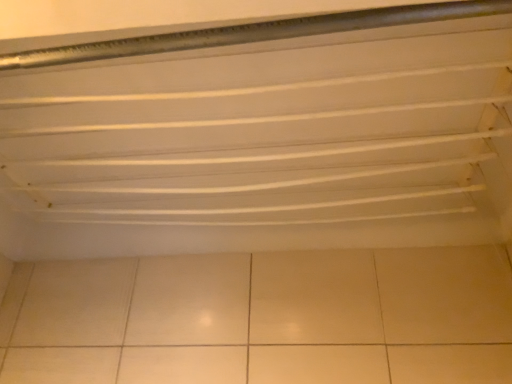
Question: Would you say beige ceramic tile at bottom is a long distance from white matte shelf at upper center?

Choices:
 (A) no
 (B) yes

Answer: (A)

Question: Does beige ceramic tile at bottom have a lesser height compared to white matte shelf at upper center?

Choices:
 (A) yes
 (B) no

Answer: (B)

Question: Is beige ceramic tile at bottom touching white matte shelf at upper center?

Choices:
 (A) no
 (B) yes

Answer: (A)

Question: From the image's perspective, does beige ceramic tile at bottom appear higher than white matte shelf at upper center?

Choices:
 (A) yes
 (B) no

Answer: (B)

Question: Is beige ceramic tile at bottom surrounding white matte shelf at upper center?

Choices:
 (A) yes
 (B) no

Answer: (B)

Question: Is beige ceramic tile at bottom wider than white matte shelf at upper center?

Choices:
 (A) no
 (B) yes

Answer: (A)

Question: From the image's perspective, is white matte shelf at upper center beneath beige ceramic tile at bottom?

Choices:
 (A) yes
 (B) no

Answer: (B)

Question: Is white matte shelf at upper center taller than beige ceramic tile at bottom?

Choices:
 (A) yes
 (B) no

Answer: (B)

Question: From a real-world perspective, is white matte shelf at upper center located beneath beige ceramic tile at bottom?

Choices:
 (A) yes
 (B) no

Answer: (B)

Question: Considering the relative sizes of white matte shelf at upper center and beige ceramic tile at bottom in the image provided, is white matte shelf at upper center smaller than beige ceramic tile at bottom?

Choices:
 (A) yes
 (B) no

Answer: (B)

Question: Would you say white matte shelf at upper center contains beige ceramic tile at bottom?

Choices:
 (A) no
 (B) yes

Answer: (A)

Question: Is white matte shelf at upper center positioned before beige ceramic tile at bottom?

Choices:
 (A) no
 (B) yes

Answer: (B)

Question: In the image, is beige ceramic tile at bottom on the left side or the right side of white matte shelf at upper center?

Choices:
 (A) right
 (B) left

Answer: (A)